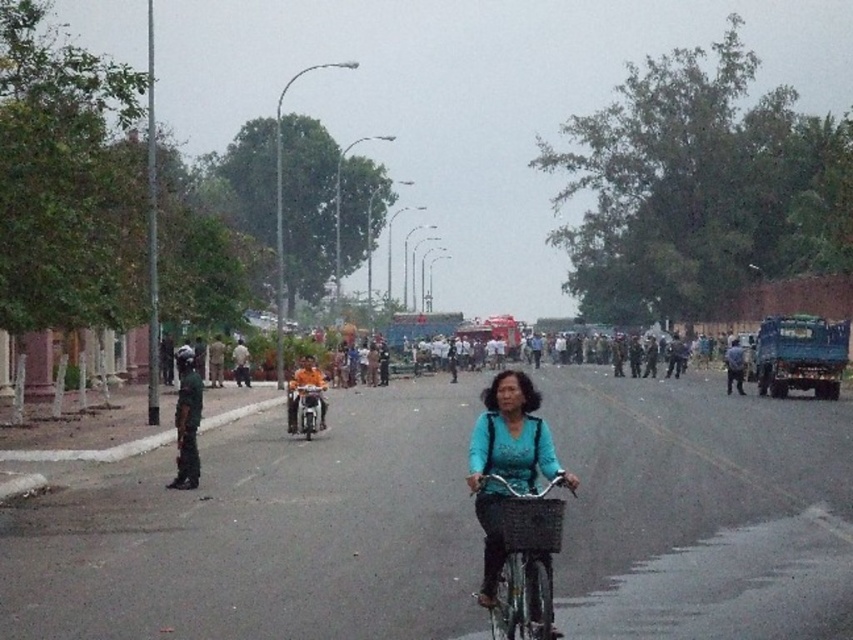
Find the location of a particular element. metallic silver bicycle at center is located at coordinates (526, 561).

Is metallic silver bicycle at center behind dark green uniform at left?

No, metallic silver bicycle at center is in front of dark green uniform at left.

Is metallic silver bicycle at center closer to the viewer compared to dark green uniform at left?

Yes, metallic silver bicycle at center is in front of dark green uniform at left.

Is point (525, 538) positioned before point (184, 456)?

Yes, it is in front of point (184, 456).

Image resolution: width=853 pixels, height=640 pixels. Find the location of `metallic silver bicycle at center`. metallic silver bicycle at center is located at coordinates (526, 561).

Is dark green uniform at left positioned at the back of metallic silver motorcycle at center?

No, dark green uniform at left is in front of metallic silver motorcycle at center.

Does dark green uniform at left lie in front of metallic silver motorcycle at center?

That is True.

Where is `dark green uniform at left`? Image resolution: width=853 pixels, height=640 pixels. dark green uniform at left is located at coordinates (187, 420).

Find the location of a particular element. dark green uniform at left is located at coordinates (187, 420).